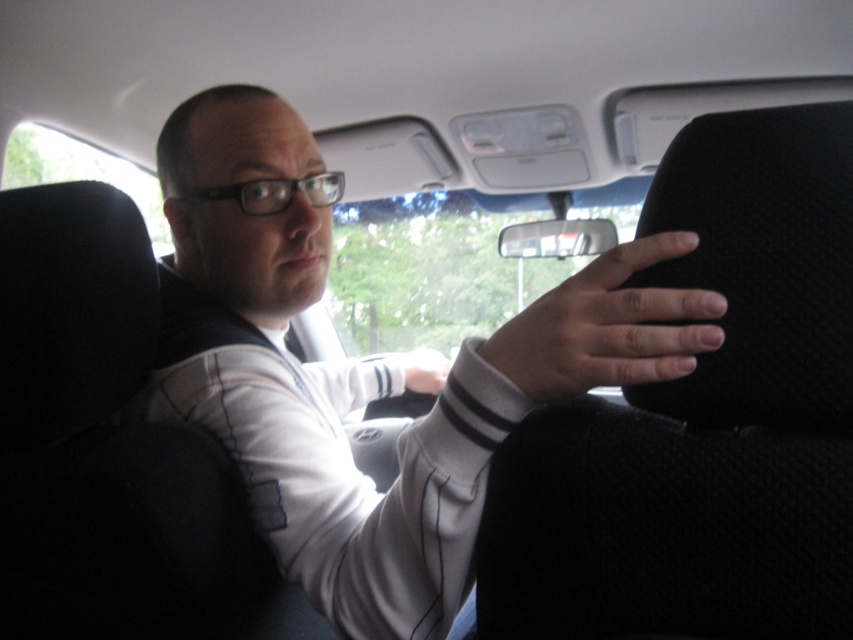
Question: Which object appears farthest from the camera in this image?

Choices:
 (A) matte white hand at center
 (B) smooth skin hand at right

Answer: (A)

Question: Which of the following is the closest to the observer?

Choices:
 (A) (444, 371)
 (B) (714, 276)
 (C) (561, 372)

Answer: (C)

Question: Is black fabric seat at center behind smooth skin hand at right?

Choices:
 (A) no
 (B) yes

Answer: (A)

Question: Where is black fabric seat at center located in relation to matte white hand at center in the image?

Choices:
 (A) above
 (B) below

Answer: (A)

Question: Is black fabric seat at center bigger than matte white hand at center?

Choices:
 (A) yes
 (B) no

Answer: (A)

Question: Which of these objects is positioned farthest from the smooth skin hand at right?

Choices:
 (A) black fabric seat at center
 (B) matte white hand at center

Answer: (B)